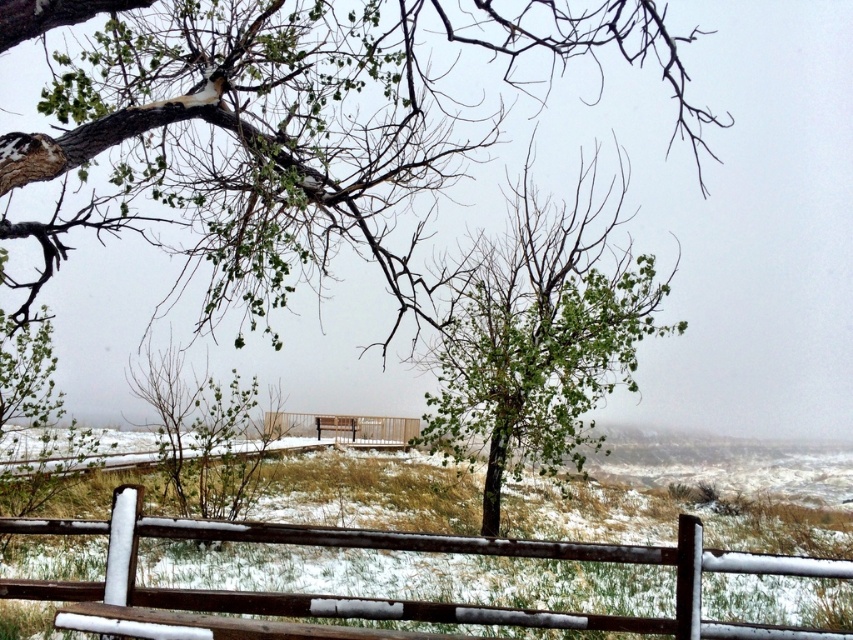
You are an observer standing in the winter landscape scene. You notice the green leafy tree at center and the brown wooden fence at center. Which object is taller?

The green leafy tree at center is taller than the brown wooden fence at center.

You are standing in the winter landscape and want to walk towards the green leafy tree at center. Which direction should you move relative to the rustic wooden fence at lower center?

To reach the green leafy tree at center, you should move forward away from the rustic wooden fence at lower center since the tree is located above the fence, indicating it is further ahead in the scene.